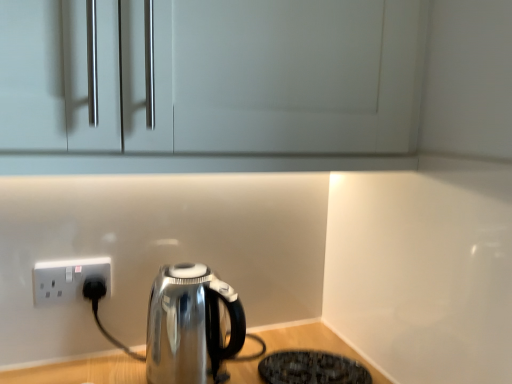
Question: Considering the relative sizes of shiny metallic kettle at lower left and black textured mat at lower right in the image provided, is shiny metallic kettle at lower left shorter than black textured mat at lower right?

Choices:
 (A) yes
 (B) no

Answer: (B)

Question: From the image's perspective, does shiny metallic kettle at lower left appear higher than black textured mat at lower right?

Choices:
 (A) no
 (B) yes

Answer: (B)

Question: From a real-world perspective, is shiny metallic kettle at lower left over black textured mat at lower right?

Choices:
 (A) yes
 (B) no

Answer: (A)

Question: Can you confirm if shiny metallic kettle at lower left is positioned to the left of black textured mat at lower right?

Choices:
 (A) no
 (B) yes

Answer: (B)

Question: Could you tell me if shiny metallic kettle at lower left is facing black textured mat at lower right?

Choices:
 (A) yes
 (B) no

Answer: (B)

Question: Considering the positions of black textured mat at lower right and white plastic socket at lower left in the image, is black textured mat at lower right taller or shorter than white plastic socket at lower left?

Choices:
 (A) short
 (B) tall

Answer: (A)

Question: Considering the relative positions of black textured mat at lower right and white plastic socket at lower left in the image provided, is black textured mat at lower right to the left or to the right of white plastic socket at lower left?

Choices:
 (A) left
 (B) right

Answer: (B)

Question: Is black textured mat at lower right in front of or behind white plastic socket at lower left in the image?

Choices:
 (A) front
 (B) behind

Answer: (A)

Question: From the image's perspective, is black textured mat at lower right positioned above or below white plastic socket at lower left?

Choices:
 (A) above
 (B) below

Answer: (B)

Question: In the image, is black textured mat at lower right positioned in front of or behind shiny metallic kettle at lower left?

Choices:
 (A) front
 (B) behind

Answer: (B)

Question: From the image's perspective, relative to shiny metallic kettle at lower left, is black textured mat at lower right above or below?

Choices:
 (A) below
 (B) above

Answer: (A)

Question: Would you say black textured mat at lower right is to the left or to the right of shiny metallic kettle at lower left in the picture?

Choices:
 (A) left
 (B) right

Answer: (B)

Question: Does point (358, 372) appear closer or farther from the camera than point (188, 340)?

Choices:
 (A) closer
 (B) farther

Answer: (B)

Question: Is shiny metallic kettle at lower left bigger or smaller than black textured mat at lower right?

Choices:
 (A) big
 (B) small

Answer: (A)

Question: Looking at their shapes, would you say shiny metallic kettle at lower left is wider or thinner than black textured mat at lower right?

Choices:
 (A) wide
 (B) thin

Answer: (B)